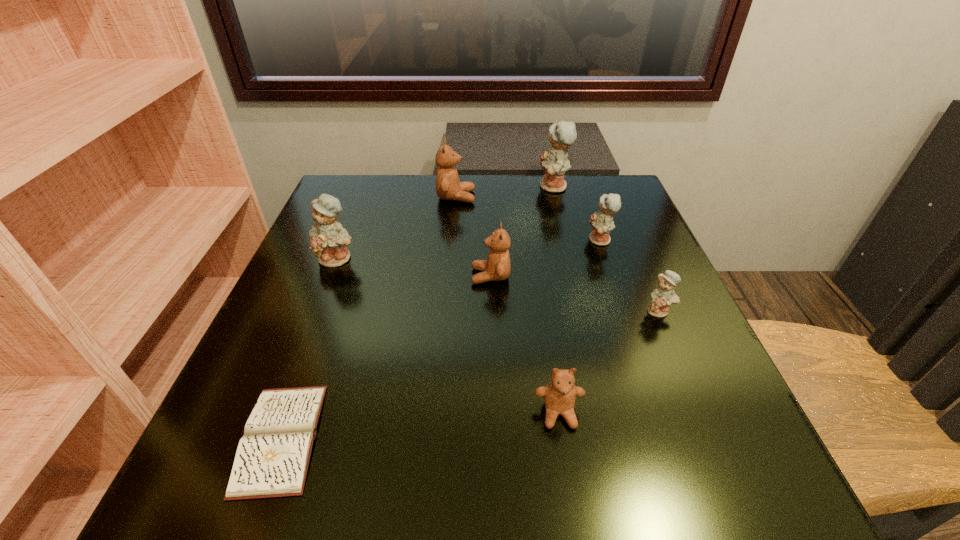
Identify the location of object that can be found as the sixth closest to the second nearest brown teddy bear. (555, 163).

Choose which teddy bear is the fifth nearest neighbor to the third biggest blue teddy bear. Please provide its 2D coordinates. Your answer should be formatted as a tuple, i.e. [(x, y)], where the tuple contains the x and y coordinates of a point satisfying the conditions above.

[(559, 395)]

Locate which teddy bear ranks second in proximity to the smallest brown teddy bear. Please provide its 2D coordinates. Your answer should be formatted as a tuple, i.e. [(x, y)], where the tuple contains the x and y coordinates of a point satisfying the conditions above.

[(497, 267)]

Choose which blue teddy bear is the nearest neighbor to the biggest brown teddy bear. Please provide its 2D coordinates. Your answer should be formatted as a tuple, i.e. [(x, y)], where the tuple contains the x and y coordinates of a point satisfying the conditions above.

[(555, 163)]

Select which blue teddy bear appears as the closest to the shortest object. Please provide its 2D coordinates. Your answer should be formatted as a tuple, i.e. [(x, y)], where the tuple contains the x and y coordinates of a point satisfying the conditions above.

[(328, 239)]

Locate an element on the screen. This screenshot has width=960, height=540. brown teddy bear object that ranks as the closest to the biggest blue teddy bear is located at coordinates (448, 186).

Choose which brown teddy bear is the nearest neighbor to the sixth teddy bear from left to right. Please provide its 2D coordinates. Your answer should be formatted as a tuple, i.e. [(x, y)], where the tuple contains the x and y coordinates of a point satisfying the conditions above.

[(497, 267)]

Image resolution: width=960 pixels, height=540 pixels. I want to click on vacant region that satisfies the following two spatial constraints: 1. on the front-facing side of the second object from right to left; 2. on the face of the smallest brown teddy bear, so click(660, 413).